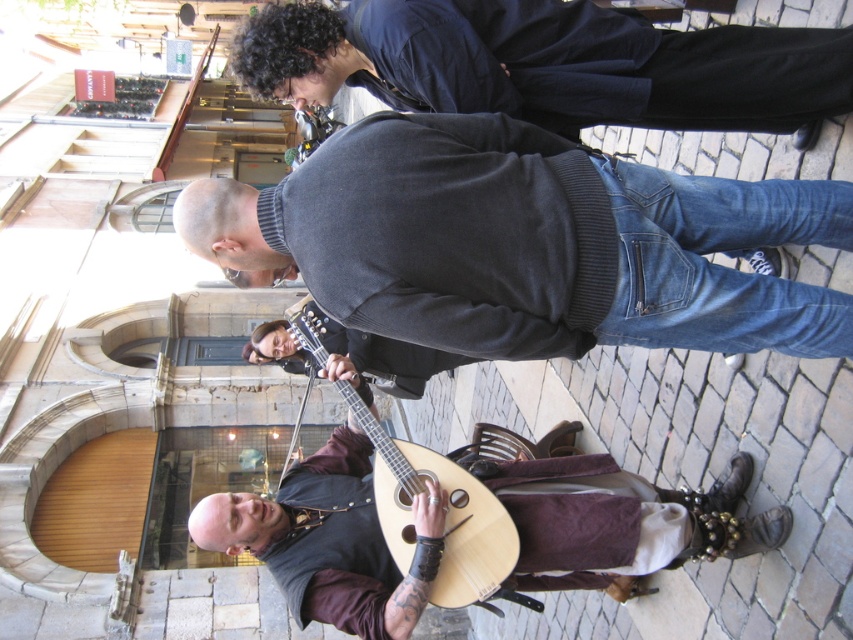
Question: Which point appears closest to the camera in this image?

Choices:
 (A) click(x=500, y=516)
 (B) click(x=439, y=40)
 (C) click(x=288, y=589)
 (D) click(x=437, y=156)

Answer: (D)

Question: Considering the real-world distances, which object is closest to the wooden mandolin at center?

Choices:
 (A) dark blue sweater at center
 (B) dark gray sweater at center
 (C) wooden acoustic guitar at center

Answer: (C)

Question: Does dark gray sweater at center have a lesser width compared to wooden mandolin at center?

Choices:
 (A) no
 (B) yes

Answer: (B)

Question: Which point is closer to the camera taking this photo?

Choices:
 (A) (608, 8)
 (B) (438, 461)
 (C) (393, 312)
 (D) (724, 502)

Answer: (C)

Question: In this image, where is wooden mandolin at center located relative to wooden acoustic guitar at center?

Choices:
 (A) right
 (B) left

Answer: (A)

Question: Does dark blue sweater at center lie behind wooden acoustic guitar at center?

Choices:
 (A) yes
 (B) no

Answer: (B)